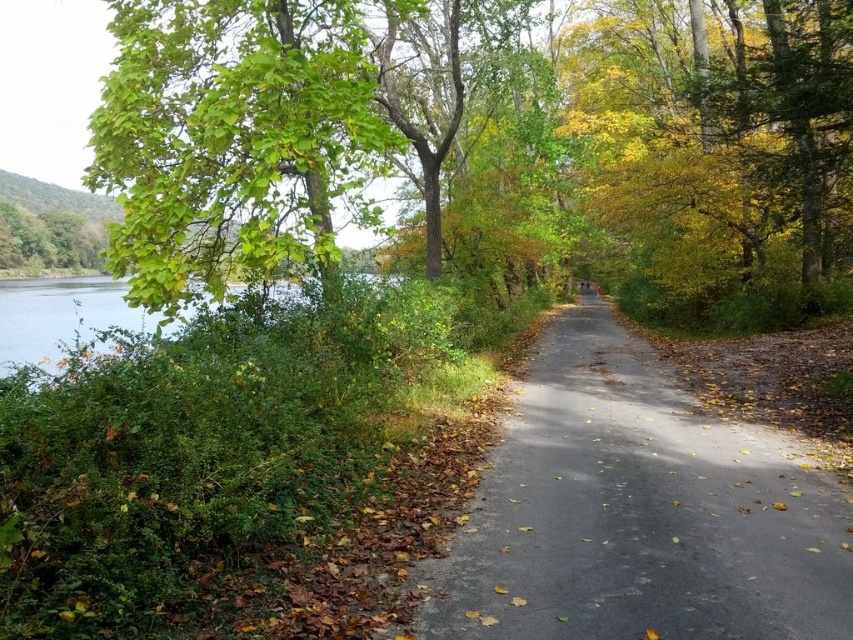
Question: From the image, what is the correct spatial relationship of gray asphalt road at center in relation to clear water at left?

Choices:
 (A) right
 (B) left

Answer: (A)

Question: Can you confirm if gray asphalt road at center is positioned below clear water at left?

Choices:
 (A) yes
 (B) no

Answer: (A)

Question: Does green leafy tree at upper left appear over clear water at left?

Choices:
 (A) yes
 (B) no

Answer: (A)

Question: Which object is the closest to the gray asphalt road at center?

Choices:
 (A) clear water at left
 (B) green leafy tree at upper left

Answer: (B)

Question: Which of these objects is positioned farthest from the clear water at left?

Choices:
 (A) green leafy tree at upper left
 (B) gray asphalt road at center

Answer: (B)

Question: Which is farther from the gray asphalt road at center?

Choices:
 (A) green leafy tree at upper left
 (B) clear water at left

Answer: (B)